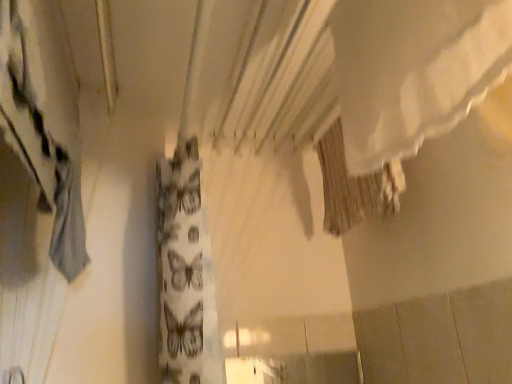
Where is `gray fabric curtain at left`? The image size is (512, 384). gray fabric curtain at left is located at coordinates (39, 182).

The width and height of the screenshot is (512, 384). What do you see at coordinates (39, 182) in the screenshot?
I see `gray fabric curtain at left` at bounding box center [39, 182].

Describe the element at coordinates (355, 186) in the screenshot. I see `brown textured fabric at upper center` at that location.

Locate an element on the screen. The image size is (512, 384). brown textured fabric at upper center is located at coordinates (355, 186).

At what (x,y) coordinates should I click in order to perform the action: click on gray fabric curtain at left. Please return your answer as a coordinate pair (x, y). Looking at the image, I should click on (39, 182).

Considering the relative positions of gray fabric curtain at left and brown textured fabric at upper center in the image provided, is gray fabric curtain at left to the left of brown textured fabric at upper center from the viewer's perspective?

Correct, you'll find gray fabric curtain at left to the left of brown textured fabric at upper center.

Is the depth of gray fabric curtain at left less than that of brown textured fabric at upper center?

Yes, gray fabric curtain at left is closer to the camera.

Is point (30, 376) less distant than point (397, 164)?

Yes, it is in front of point (397, 164).

From the image's perspective, would you say gray fabric curtain at left is shown under brown textured fabric at upper center?

No, from the image's perspective, gray fabric curtain at left is not below brown textured fabric at upper center.

From a real-world perspective, between gray fabric curtain at left and brown textured fabric at upper center, who is vertically lower?

gray fabric curtain at left.

Between gray fabric curtain at left and brown textured fabric at upper center, which one has larger width?

gray fabric curtain at left is wider.

Is gray fabric curtain at left taller than brown textured fabric at upper center?

Correct, gray fabric curtain at left is much taller as brown textured fabric at upper center.

Is gray fabric curtain at left bigger or smaller than brown textured fabric at upper center?

gray fabric curtain at left is bigger than brown textured fabric at upper center.

Is gray fabric curtain at left outside of brown textured fabric at upper center?

Yes, gray fabric curtain at left is located beyond the bounds of brown textured fabric at upper center.

Is there a large distance between gray fabric curtain at left and brown textured fabric at upper center?

No, gray fabric curtain at left is not far from brown textured fabric at upper center.

Is gray fabric curtain at left oriented towards brown textured fabric at upper center?

Yes.

How many degrees apart are the facing directions of gray fabric curtain at left and brown textured fabric at upper center?

They differ by 180 degrees in their facing directions.

How distant is gray fabric curtain at left from brown textured fabric at upper center?

gray fabric curtain at left is 86.24 centimeters from brown textured fabric at upper center.

Where is `shower curtain that is below the gray fabric curtain at left (from the image's perspective)`? Image resolution: width=512 pixels, height=384 pixels. shower curtain that is below the gray fabric curtain at left (from the image's perspective) is located at coordinates (355, 186).

Would you say brown textured fabric at upper center is to the left or to the right of gray fabric curtain at left in the picture?

Clearly, brown textured fabric at upper center is on the right of gray fabric curtain at left in the image.

Does brown textured fabric at upper center lie behind gray fabric curtain at left?

Yes.

Considering the points (350, 224) and (41, 23), which point is in front, point (350, 224) or point (41, 23)?

Point (41, 23)

From the image's perspective, which one is positioned lower, brown textured fabric at upper center or gray fabric curtain at left?

brown textured fabric at upper center is shown below in the image.

From a real-world perspective, is brown textured fabric at upper center above or below gray fabric curtain at left?

In terms of real-world spatial position, brown textured fabric at upper center is above gray fabric curtain at left.

Does brown textured fabric at upper center have a greater width compared to gray fabric curtain at left?

Incorrect, the width of brown textured fabric at upper center does not surpass that of gray fabric curtain at left.

Which of these two, brown textured fabric at upper center or gray fabric curtain at left, stands shorter?

With less height is brown textured fabric at upper center.

Based on their sizes in the image, would you say brown textured fabric at upper center is bigger or smaller than gray fabric curtain at left?

Considering their sizes, brown textured fabric at upper center takes up less space than gray fabric curtain at left.

Can we say brown textured fabric at upper center lies outside gray fabric curtain at left?

Yes, brown textured fabric at upper center is outside of gray fabric curtain at left.

Would you say brown textured fabric at upper center is a long distance from gray fabric curtain at left?

Actually, brown textured fabric at upper center and gray fabric curtain at left are a little close together.

Is brown textured fabric at upper center facing away from gray fabric curtain at left?

No.

The image size is (512, 384). What are the coordinates of `shower curtain positioned vertically above the gray fabric curtain at left (from a real-world perspective)` in the screenshot? It's located at click(x=355, y=186).

This screenshot has height=384, width=512. I want to click on curtain located above the brown textured fabric at upper center (from the image's perspective), so coord(39,182).

Locate an element on the screen. This screenshot has width=512, height=384. shower curtain to the right of gray fabric curtain at left is located at coordinates (355, 186).